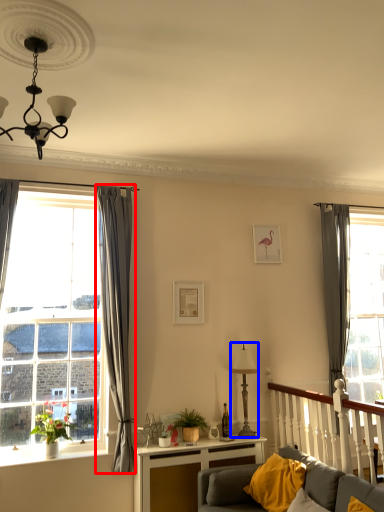
Question: Which object appears closest to the camera in this image, curtain (highlighted by a red box) or lamp (highlighted by a blue box)?

Choices:
 (A) curtain
 (B) lamp

Answer: (A)